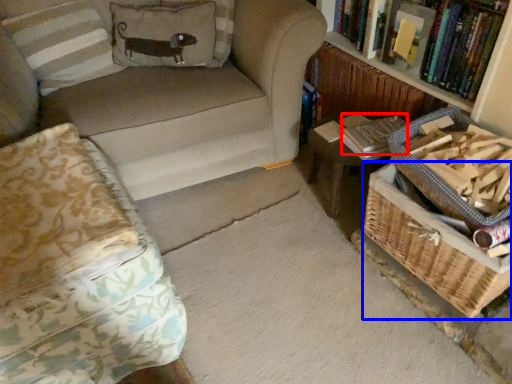
Question: Which object appears farthest to the camera in this image, paperback book (highlighted by a red box) or basket (highlighted by a blue box)?

Choices:
 (A) paperback book
 (B) basket

Answer: (A)